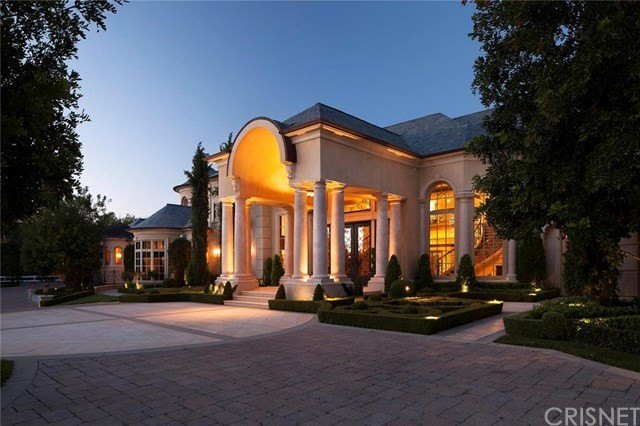
You are a GUI agent. You are given a task and a screenshot of the screen. Output one action in this format:
    pyautogui.click(x=<x>, y=<y>)
    Task: Click on the entrance
    The width and height of the screenshot is (640, 426).
    Given the screenshot: What is the action you would take?
    pyautogui.click(x=268, y=282), pyautogui.click(x=351, y=255)